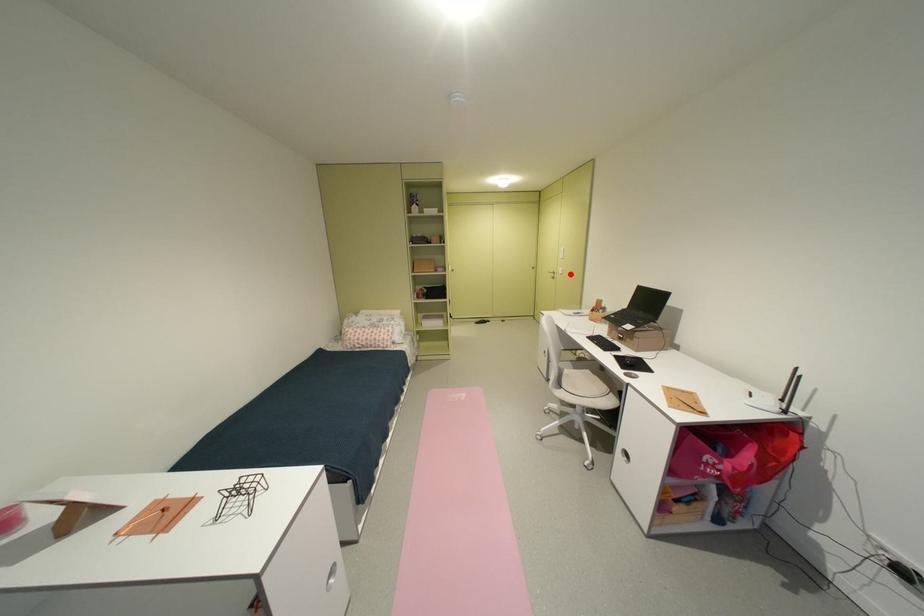
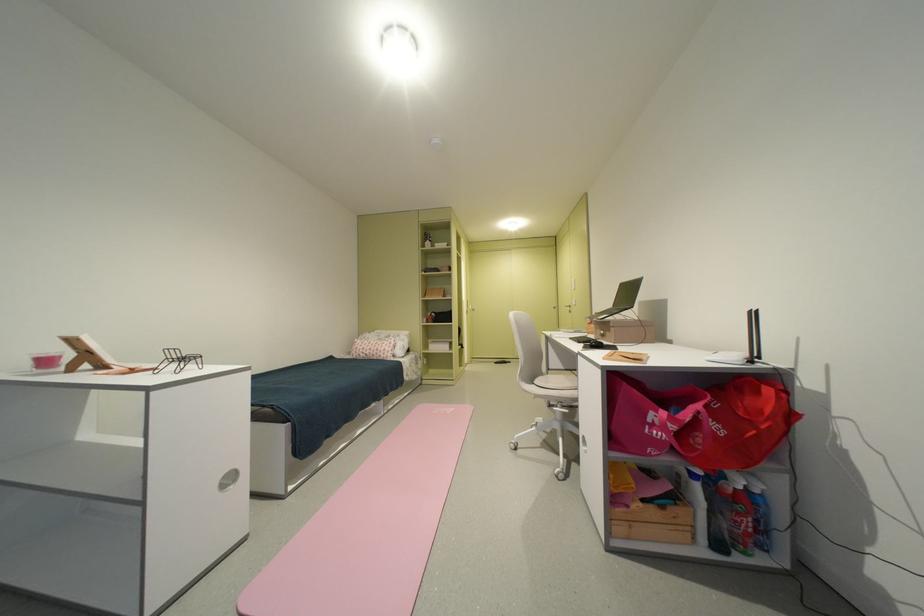
Locate, in the second image, the point that corresponds to the highlighted location in the first image.

(584, 305)